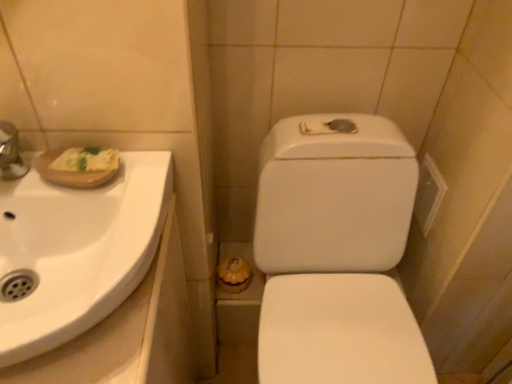
Question: From a real-world perspective, relative to white glossy toilet at center, is white glossy sink at upper left vertically above or below?

Choices:
 (A) above
 (B) below

Answer: (A)

Question: Considering the relative positions of white glossy sink at upper left and white glossy toilet at center in the image provided, is white glossy sink at upper left to the left or to the right of white glossy toilet at center?

Choices:
 (A) left
 (B) right

Answer: (A)

Question: From the image's perspective, is white glossy sink at upper left above or below white glossy toilet at center?

Choices:
 (A) below
 (B) above

Answer: (B)

Question: Is white glossy toilet at center in front of or behind white glossy sink at upper left in the image?

Choices:
 (A) behind
 (B) front

Answer: (A)

Question: Considering the relative positions of white glossy toilet at center and white glossy sink at upper left in the image provided, is white glossy toilet at center to the left or to the right of white glossy sink at upper left?

Choices:
 (A) right
 (B) left

Answer: (A)

Question: From a real-world perspective, is white glossy toilet at center physically located above or below white glossy sink at upper left?

Choices:
 (A) above
 (B) below

Answer: (B)

Question: Considering the positions of white glossy toilet at center and white glossy sink at upper left in the image, is white glossy toilet at center wider or thinner than white glossy sink at upper left?

Choices:
 (A) thin
 (B) wide

Answer: (B)